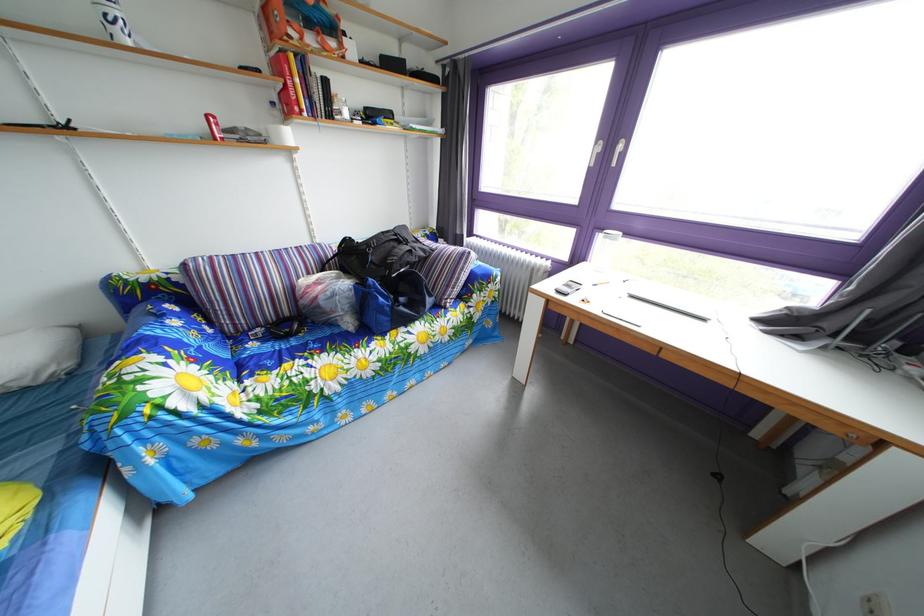
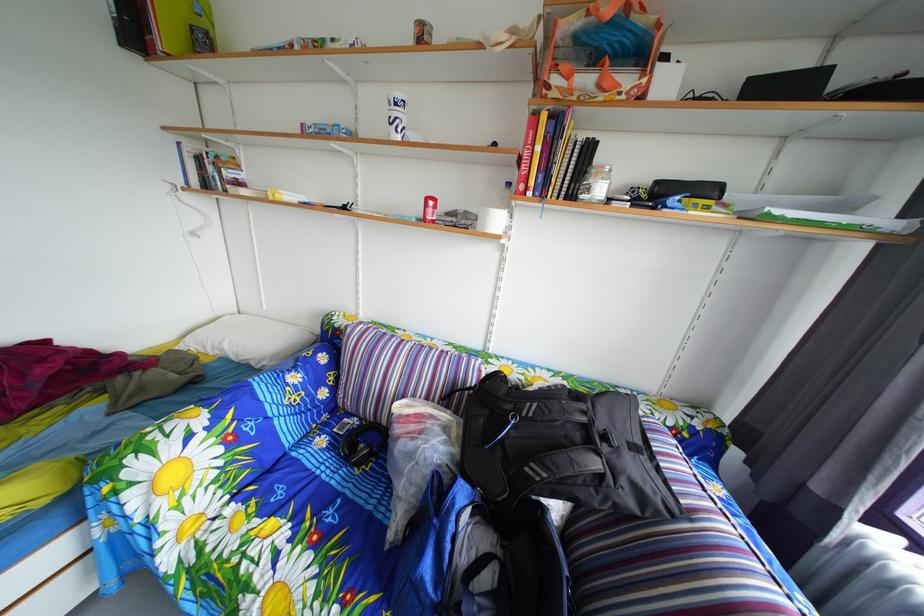
The point at (282, 367) is marked in the first image. Where is the corresponding point in the second image?

(301, 493)